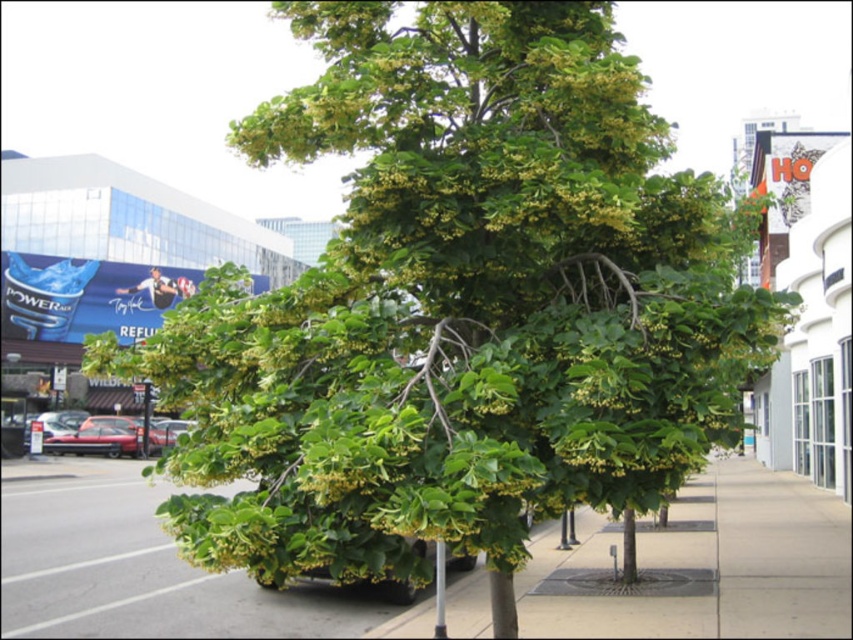
Question: Can you confirm if green leafy tree at center is thinner than metallic silver pole at lower center?

Choices:
 (A) no
 (B) yes

Answer: (A)

Question: Which of the following is the farthest from the observer?

Choices:
 (A) (444, 632)
 (B) (711, 548)

Answer: (B)

Question: Which of the following is the farthest from the observer?

Choices:
 (A) green leafy tree at center
 (B) metallic silver pole at lower center

Answer: (A)

Question: Is green leafy tree at center bigger than metallic silver pole at lower center?

Choices:
 (A) yes
 (B) no

Answer: (A)

Question: Which of the following is the closest to the observer?

Choices:
 (A) (x=610, y=525)
 (B) (x=444, y=548)

Answer: (B)

Question: Can you confirm if green leafy tree at center is thinner than metallic silver pole at lower center?

Choices:
 (A) no
 (B) yes

Answer: (A)